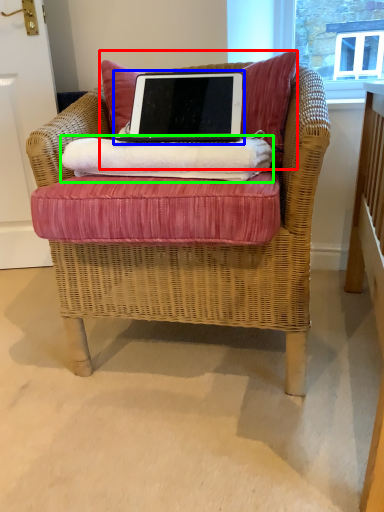
Question: Which object is positioned closest to pillow (highlighted by a red box)? Select from laptop (highlighted by a blue box) and material (highlighted by a green box).

Choices:
 (A) laptop
 (B) material

Answer: (A)